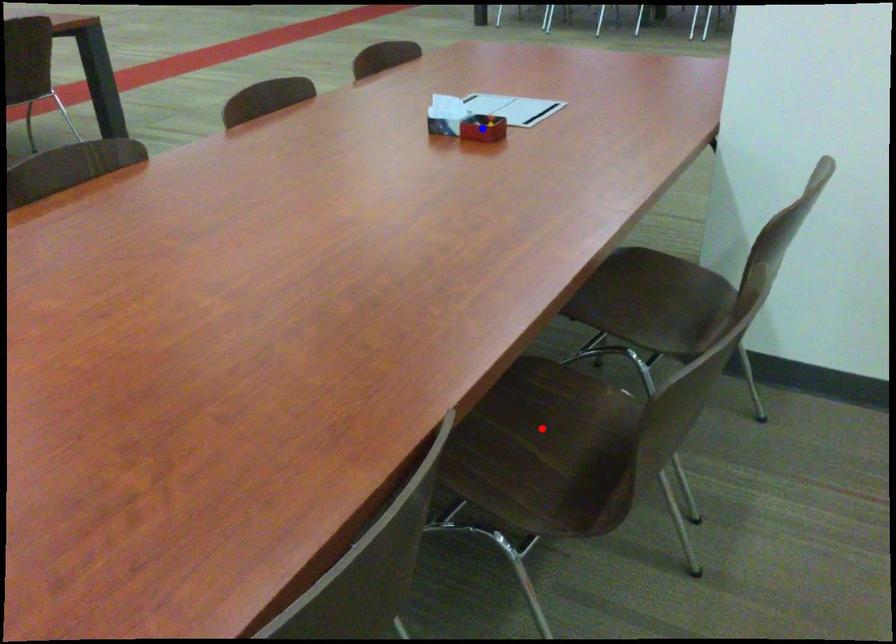
Question: Two points are marked on the image. Which point is closer to the camera?

Choices:
 (A) Blue point is closer.
 (B) Red point is closer.

Answer: (B)